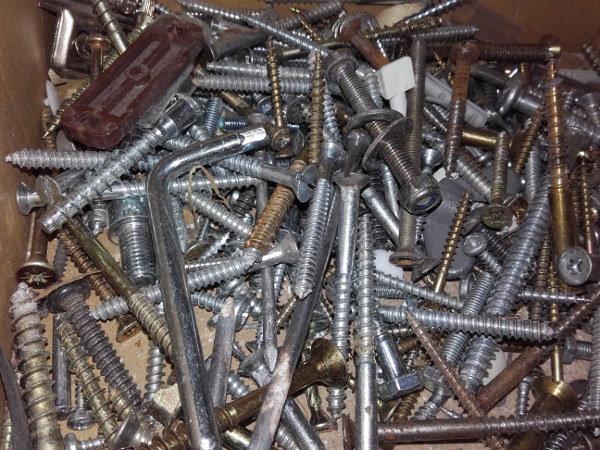
Identify the location of cardboard box. (21, 107), (552, 25), (512, 406), (137, 357).